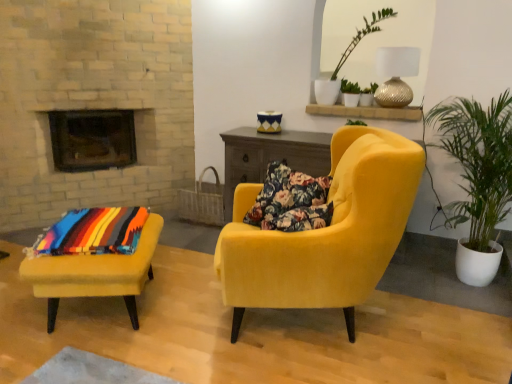
This screenshot has height=384, width=512. What do you see at coordinates (291, 201) in the screenshot?
I see `floral fabric pillow at center` at bounding box center [291, 201].

This screenshot has height=384, width=512. What do you see at coordinates (395, 75) in the screenshot?
I see `gold textured lamp at upper right` at bounding box center [395, 75].

In order to face velvet yellow ottoman at lower left, which is the 1th chair in left-to-right order, should I rotate leftwards or rightwards?

You should look left and rotate roughly 19.848 degrees.

What is the approximate width of velvet yellow armchair at center, which ranks as the 2th chair in left-to-right order?

velvet yellow armchair at center, which ranks as the 2th chair in left-to-right order, is 1.04 meters wide.

Where is `multicolored woven blanket at lower left`? The height and width of the screenshot is (384, 512). multicolored woven blanket at lower left is located at coordinates (93, 232).

Identify the location of black glass fireplace at upper left. (92, 139).

What do you see at coordinates (92, 139) in the screenshot? This screenshot has height=384, width=512. I see `black glass fireplace at upper left` at bounding box center [92, 139].

Identify the location of floral fabric pillow at center. 291,201.

In terms of size, does gold textured lamp at upper right appear bigger or smaller than velvet yellow armchair at center, which ranks as the 2th chair in left-to-right order?

gold textured lamp at upper right is smaller than velvet yellow armchair at center, which ranks as the 2th chair in left-to-right order.

From the image's perspective, between gold textured lamp at upper right and velvet yellow armchair at center, which ranks as the first chair in right-to-left order, who is located below?

velvet yellow armchair at center, which ranks as the first chair in right-to-left order.

Is there a large distance between gold textured lamp at upper right and velvet yellow armchair at center, which ranks as the 2th chair in left-to-right order?

Yes.

Locate an element on the screen. lamp positioned vertically above the velvet yellow armchair at center, which ranks as the 2th chair in left-to-right order (from a real-world perspective) is located at coordinates (395, 75).

Does gold textured lamp at upper right appear on the left side of multicolored woven blanket at lower left?

No, gold textured lamp at upper right is not to the left of multicolored woven blanket at lower left.

Find the location of a particular element. The image size is (512, 384). lamp behind the multicolored woven blanket at lower left is located at coordinates (395, 75).

Which object is further away from the camera taking this photo, gold textured lamp at upper right or multicolored woven blanket at lower left?

gold textured lamp at upper right.

From the image's perspective, which object appears higher, gold textured lamp at upper right or multicolored woven blanket at lower left?

gold textured lamp at upper right.

Who is more distant, velvet yellow ottoman at lower left, which is the 1th chair in left-to-right order, or green leafy plant in white pot at right?

velvet yellow ottoman at lower left, which is the 1th chair in left-to-right order.

Can you confirm if velvet yellow ottoman at lower left, which is the 2th chair in right-to-left order, is smaller than green leafy plant in white pot at right?

Yes.

Consider the image. From the image's perspective, does velvet yellow ottoman at lower left, which is the 1th chair in left-to-right order, appear lower than green leafy plant in white pot at right?

Yes.

This screenshot has height=384, width=512. Find the location of `the 2nd chair to the left of the green leafy plant in white pot at right, counting from the anchor's position`. the 2nd chair to the left of the green leafy plant in white pot at right, counting from the anchor's position is located at coordinates (94, 273).

Consider the image. From a real-world perspective, who is located higher, velvet yellow ottoman at lower left, which is the 2th chair in right-to-left order, or multicolored woven blanket at lower left?

From a 3D spatial view, multicolored woven blanket at lower left is above.

From the image's perspective, between velvet yellow ottoman at lower left, which is the 2th chair in right-to-left order, and multicolored woven blanket at lower left, which one is located above?

multicolored woven blanket at lower left is shown above in the image.

This screenshot has width=512, height=384. There is a velvet yellow ottoman at lower left, which is the 1th chair in left-to-right order. In order to click on blanket above it (from a real-world perspective) in this screenshot , I will do point(93,232).

Is velvet yellow ottoman at lower left, which is the 1th chair in left-to-right order, aimed at multicolored woven blanket at lower left?

No, velvet yellow ottoman at lower left, which is the 1th chair in left-to-right order, is not oriented towards multicolored woven blanket at lower left.

What's the angular difference between black glass fireplace at upper left and velvet yellow armchair at center, which ranks as the 2th chair in left-to-right order,'s facing directions?

There is a 115-degree angle between the facing directions of black glass fireplace at upper left and velvet yellow armchair at center, which ranks as the 2th chair in left-to-right order.

Where is `fireplace that is above the velvet yellow armchair at center, which ranks as the first chair in right-to-left order (from the image's perspective)`? fireplace that is above the velvet yellow armchair at center, which ranks as the first chair in right-to-left order (from the image's perspective) is located at coordinates (92, 139).

Considering their positions, is black glass fireplace at upper left located in front of or behind velvet yellow armchair at center, which ranks as the first chair in right-to-left order?

In the image, black glass fireplace at upper left appears behind velvet yellow armchair at center, which ranks as the first chair in right-to-left order.

Is black glass fireplace at upper left to the left or to the right of velvet yellow armchair at center, which ranks as the 2th chair in left-to-right order, in the image?

Clearly, black glass fireplace at upper left is on the left of velvet yellow armchair at center, which ranks as the 2th chair in left-to-right order, in the image.

Which object is positioned more to the left, green leafy plant at upper center or multicolored woven blanket at lower left?

multicolored woven blanket at lower left is more to the left.

Is green leafy plant at upper center not close to multicolored woven blanket at lower left?

Yes, green leafy plant at upper center and multicolored woven blanket at lower left are located far from each other.

Where is `blanket below the green leafy plant at upper center (from the image's perspective)`? This screenshot has width=512, height=384. blanket below the green leafy plant at upper center (from the image's perspective) is located at coordinates (93, 232).

Which object is positioned more to the right, black glass fireplace at upper left or floral fabric pillow at center?

From the viewer's perspective, floral fabric pillow at center appears more on the right side.

There is a floral fabric pillow at center. Find the location of `fireplace above it (from a real-world perspective)`. fireplace above it (from a real-world perspective) is located at coordinates (92, 139).

From the image's perspective, relative to floral fabric pillow at center, is black glass fireplace at upper left above or below?

From the image's perspective, black glass fireplace at upper left appears above floral fabric pillow at center.

Who is bigger, black glass fireplace at upper left or floral fabric pillow at center?

black glass fireplace at upper left is bigger.

I want to click on lamp above the velvet yellow armchair at center, which ranks as the 2th chair in left-to-right order (from the image's perspective), so click(x=395, y=75).

Find the location of a particular element. This screenshot has height=384, width=512. blanket below the gold textured lamp at upper right (from a real-world perspective) is located at coordinates (93, 232).

Which object lies further to the anchor point gold textured lamp at upper right, green leafy plant in white pot at right or green leafy plant at upper center?

green leafy plant in white pot at right lies further to gold textured lamp at upper right than the other object.

From the image, which object appears to be nearer to floral fabric pillow at center, green leafy plant at upper center or multicolored woven blanket at lower left?

multicolored woven blanket at lower left is positioned closer to the anchor floral fabric pillow at center.

Looking at the image, which one is located closer to multicolored woven blanket at lower left, green leafy plant at upper center or velvet yellow ottoman at lower left, which is the 2th chair in right-to-left order?

The object closer to multicolored woven blanket at lower left is velvet yellow ottoman at lower left, which is the 2th chair in right-to-left order.

Based on their spatial positions, is green leafy plant in white pot at right or velvet yellow ottoman at lower left, which is the 1th chair in left-to-right order, closer to multicolored woven blanket at lower left?

Based on the image, velvet yellow ottoman at lower left, which is the 1th chair in left-to-right order, appears to be nearer to multicolored woven blanket at lower left.

Based on their spatial positions, is velvet yellow armchair at center, which ranks as the 2th chair in left-to-right order, or green leafy plant in white pot at right closer to gold textured lamp at upper right?

Based on the image, green leafy plant in white pot at right appears to be nearer to gold textured lamp at upper right.

Estimate the real-world distances between objects in this image. Which object is further from floral fabric pillow at center, gold textured lamp at upper right or velvet yellow armchair at center, which ranks as the 2th chair in left-to-right order?

Based on the image, gold textured lamp at upper right appears to be further to floral fabric pillow at center.

From the image, which object appears to be farther from black glass fireplace at upper left, gold textured lamp at upper right or velvet yellow armchair at center, which ranks as the first chair in right-to-left order?

gold textured lamp at upper right.

Based on their spatial positions, is velvet yellow ottoman at lower left, which is the 1th chair in left-to-right order, or multicolored woven blanket at lower left further from gold textured lamp at upper right?

Among the two, velvet yellow ottoman at lower left, which is the 1th chair in left-to-right order, is located further to gold textured lamp at upper right.

This screenshot has height=384, width=512. In order to click on pillow between multicolored woven blanket at lower left and green leafy plant at upper center in the horizontal direction in this screenshot , I will do `click(291, 201)`.

In order to click on chair between velvet yellow ottoman at lower left, which is the 2th chair in right-to-left order, and gold textured lamp at upper right, in the horizontal direction in this screenshot , I will do `click(326, 233)`.

Image resolution: width=512 pixels, height=384 pixels. What are the coordinates of `pillow situated between velvet yellow ottoman at lower left, which is the 1th chair in left-to-right order, and green leafy plant at upper center from left to right` in the screenshot? It's located at (291, 201).

I want to click on pillow between black glass fireplace at upper left and green leafy plant at upper center, so click(x=291, y=201).